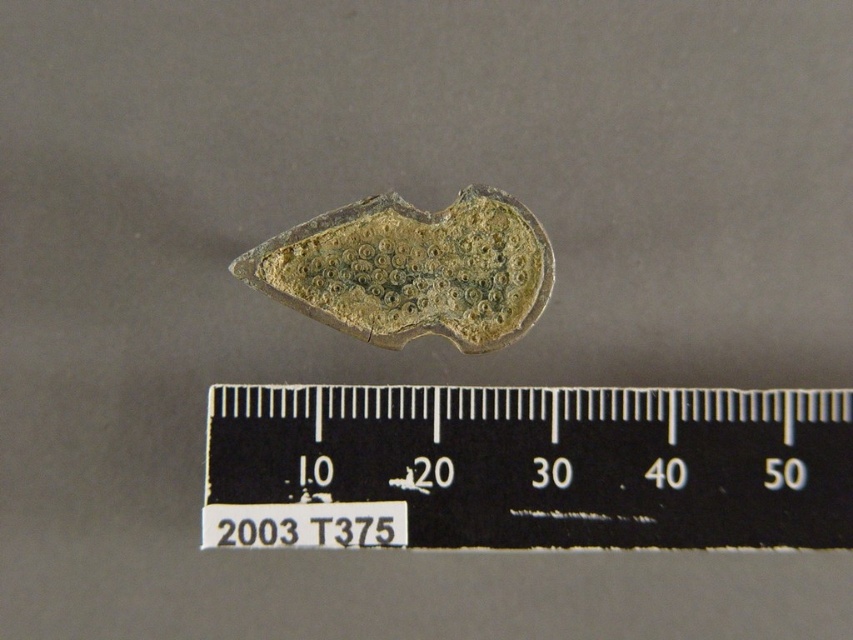
Measure the distance between black plastic ruler at center and green patina metal at center.

black plastic ruler at center and green patina metal at center are 5.34 inches apart.

Find the location of a particular element. black plastic ruler at center is located at coordinates pyautogui.click(x=527, y=467).